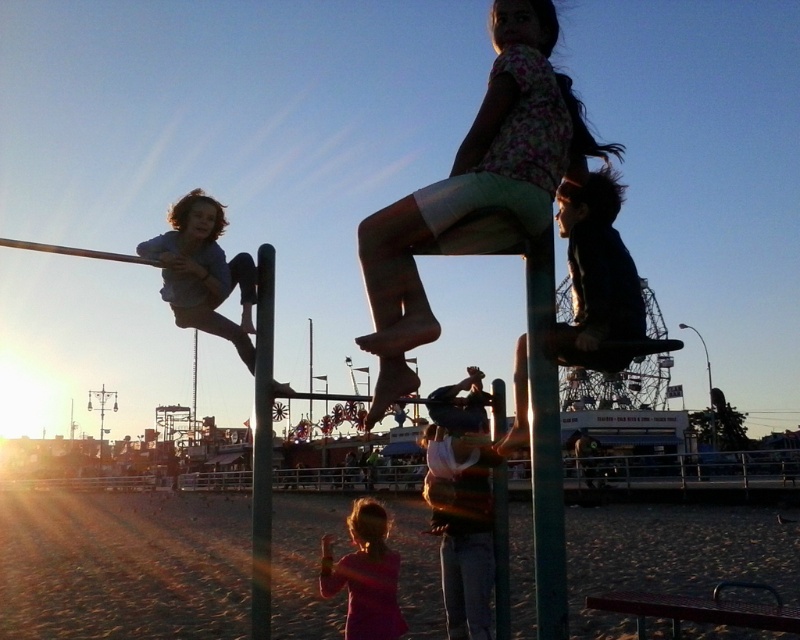
Question: Is the position of green metallic pole at center more distant than that of green textured pole at center?

Choices:
 (A) no
 (B) yes

Answer: (A)

Question: Among these objects, which one is farthest from the camera?

Choices:
 (A) light blue denim shorts at left
 (B) green textured pole at center
 (C) floral fabric dress at upper center
 (D) metallic green pole at center

Answer: (B)

Question: Which object appears closest to the camera in this image?

Choices:
 (A) green textured pole at center
 (B) green metallic pole at center
 (C) pink fabric dress at lower center

Answer: (B)

Question: Is floral fabric dress at upper center below green metallic pole at center?

Choices:
 (A) no
 (B) yes

Answer: (A)

Question: Is light blue denim shorts at left positioned in front of metallic green pole at center?

Choices:
 (A) no
 (B) yes

Answer: (A)

Question: Which point is closer to the camera?

Choices:
 (A) metallic green pole at center
 (B) green metallic pole at center

Answer: (B)